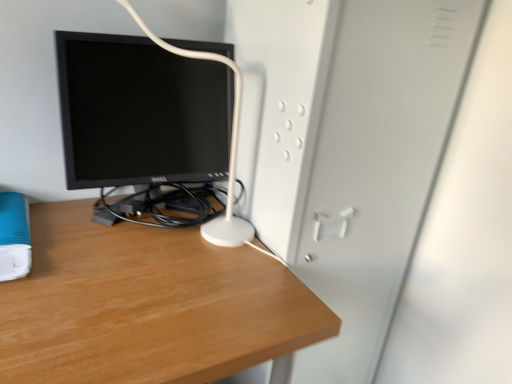
The height and width of the screenshot is (384, 512). In order to click on vacant point above wooden desk at center (from a real-world perspective) in this screenshot , I will do `click(138, 261)`.